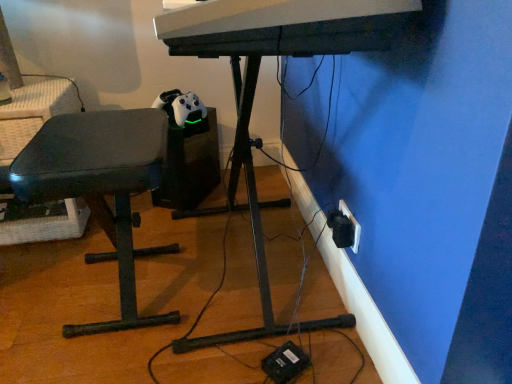
Image resolution: width=512 pixels, height=384 pixels. Find the location of `empty space that is in between matte black bench at left and white plastic computer desk at center`. empty space that is in between matte black bench at left and white plastic computer desk at center is located at coordinates (180, 303).